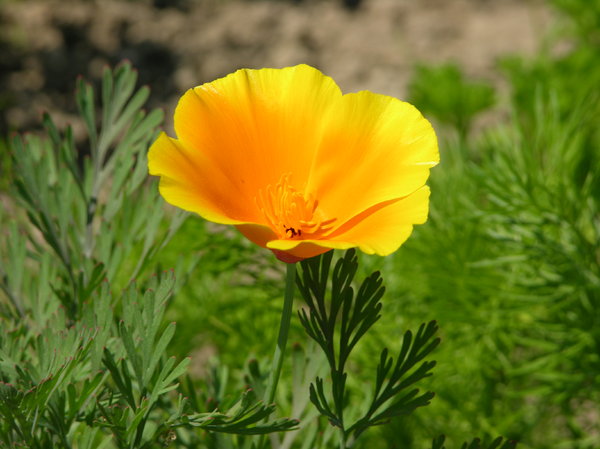
At what (x,y) coordinates should I click in order to perform the action: click on plant. Please return your answer as a coordinate pair (x, y). Looking at the image, I should click on click(x=338, y=421), click(x=138, y=417), click(x=33, y=400), click(x=75, y=289), click(x=149, y=222), click(x=94, y=210), click(x=52, y=236).